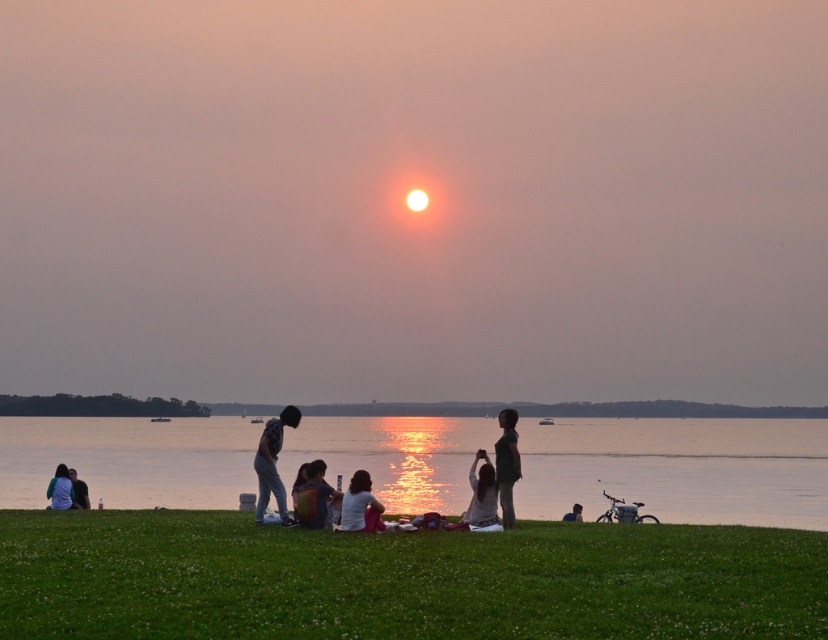
You are standing at the point marked as point (402, 579) in the image, which is in the green grassy field at lower center. You want to walk towards the sun. In which direction should you walk?

The sun is positioned near the center of the frame, low on the horizon. Since you are in the green grassy field at lower center, walking towards the sun would mean heading towards the direction where the sun is located, which is towards the horizon line in the image. Therefore, you should walk forward in the direction facing away from the grassy area towards the water and the sky where the sun is setting.

You are a photographer standing at the edge of the water, wanting to capture a photo that includes both the dark green fabric shirt at center and the dark gray sweater at lower left. Since you want to highlight the height difference between them, which object should you position closer to the bottom of the frame?

The dark gray sweater at lower left should be positioned closer to the bottom of the frame because it has a smaller height compared to the dark green fabric shirt at center.